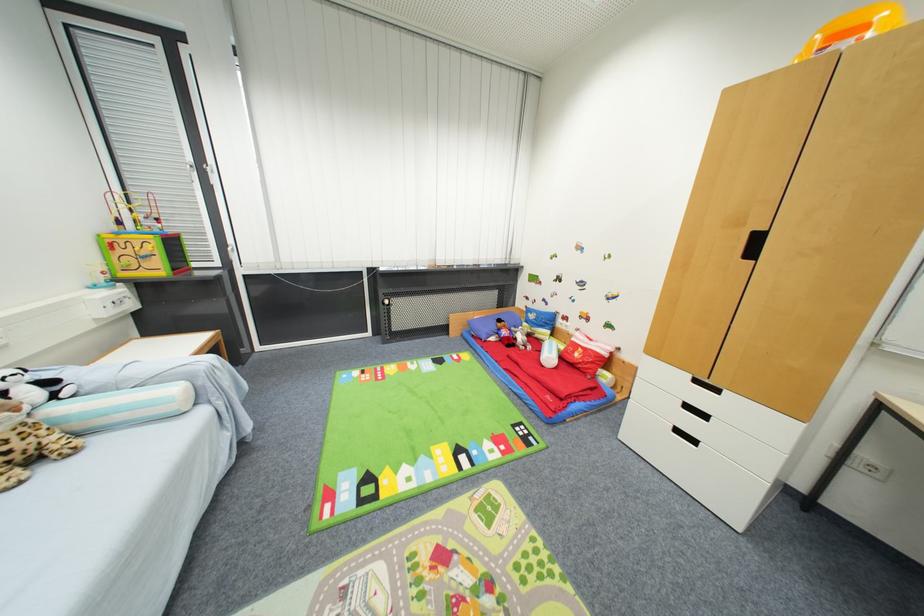
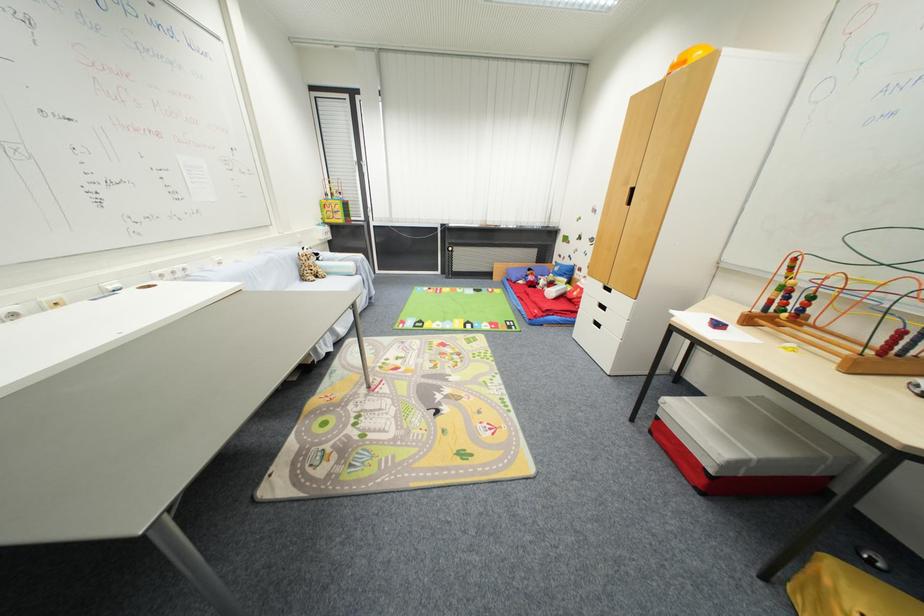
Find the pixel in the second image that matches (695,378) in the first image.

(606, 286)